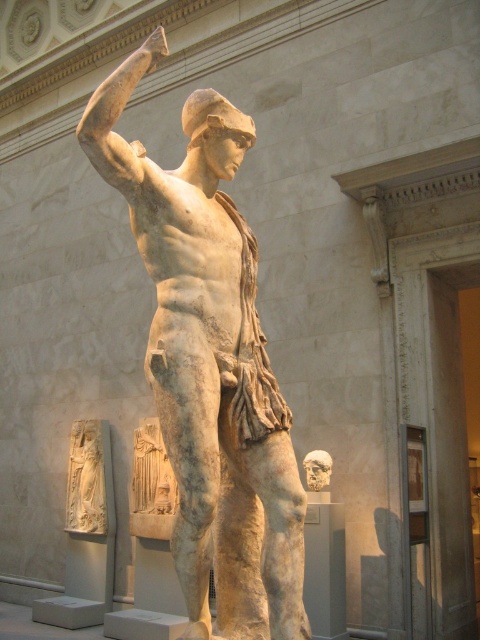
Is point (283, 618) farther from viewer compared to point (324, 467)?

No, it is in front of (324, 467).

Between white marble statue at center and matte stone head at center, which one is positioned lower?

Positioned lower is matte stone head at center.

Where is `white marble statue at center`? white marble statue at center is located at coordinates (210, 364).

Identify the location of white marble statue at center. The height and width of the screenshot is (640, 480). (210, 364).

At what (x,y) coordinates should I click in order to perform the action: click on white marble relief at lower left. Please return your answer as a coordinate pair (x, y). Looking at the image, I should click on tap(86, 480).

Does white marble relief at lower left have a lesser width compared to matte stone head at center?

No.

The height and width of the screenshot is (640, 480). What do you see at coordinates (86, 480) in the screenshot?
I see `white marble relief at lower left` at bounding box center [86, 480].

You are a GUI agent. You are given a task and a screenshot of the screen. Output one action in this format:
    pyautogui.click(x=<x>, y=<y>)
    Task: Click on the white marble relief at lower left
    This screenshot has width=480, height=640.
    Given the screenshot: What is the action you would take?
    pyautogui.click(x=86, y=480)

Does white marble statue at center have a smaller size compared to white marble relief at lower left?

Actually, white marble statue at center might be larger than white marble relief at lower left.

Which is more to the left, white marble statue at center or white marble relief at lower left?

Positioned to the left is white marble relief at lower left.

Where is `white marble statue at center`? white marble statue at center is located at coordinates (210, 364).